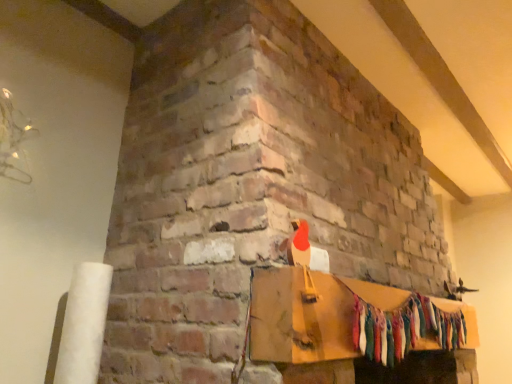
Question: Is multicolored fabric garland at center bigger or smaller than wooden mantel at upper center?

Choices:
 (A) small
 (B) big

Answer: (A)

Question: Which is correct: multicolored fabric garland at center is inside wooden mantel at upper center, or outside of it?

Choices:
 (A) outside
 (B) inside

Answer: (B)

Question: In terms of height, does multicolored fabric garland at center look taller or shorter compared to wooden mantel at upper center?

Choices:
 (A) tall
 (B) short

Answer: (A)

Question: From the image's perspective, relative to multicolored fabric garland at center, is wooden mantel at upper center above or below?

Choices:
 (A) below
 (B) above

Answer: (B)

Question: Is wooden mantel at upper center wider or thinner than multicolored fabric garland at center?

Choices:
 (A) wide
 (B) thin

Answer: (A)

Question: Considering the positions of wooden mantel at upper center and multicolored fabric garland at center in the image, is wooden mantel at upper center taller or shorter than multicolored fabric garland at center?

Choices:
 (A) short
 (B) tall

Answer: (A)

Question: Relative to multicolored fabric garland at center, is wooden mantel at upper center in front or behind?

Choices:
 (A) front
 (B) behind

Answer: (A)